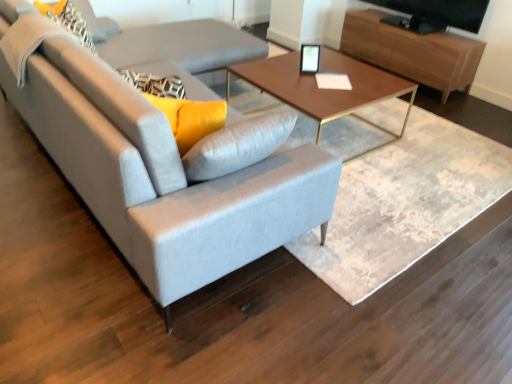
This screenshot has height=384, width=512. Identify the location of free location in front of matte black picture frame at center. (313, 74).